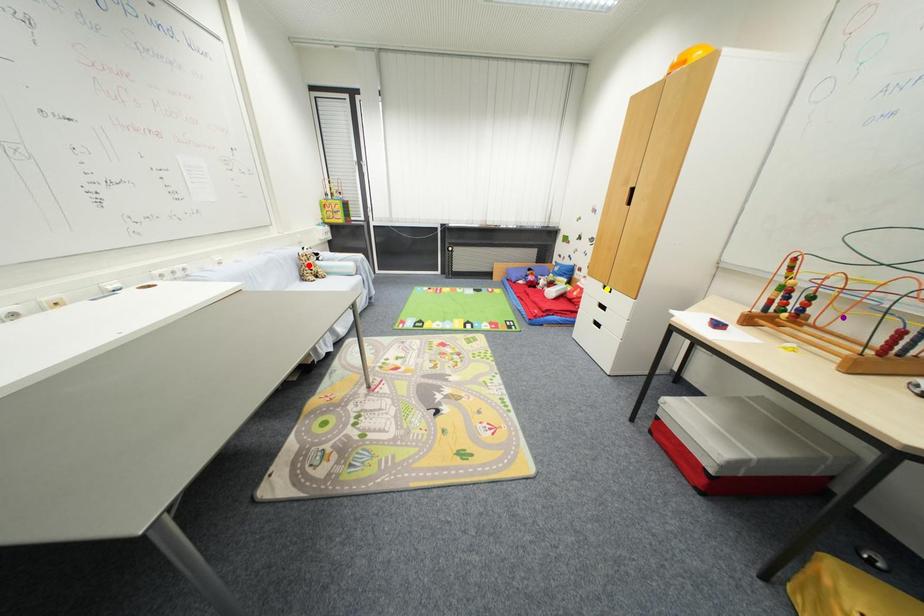
Order these from farthest to nearest:
purple point, red point, yellow point

yellow point → red point → purple point